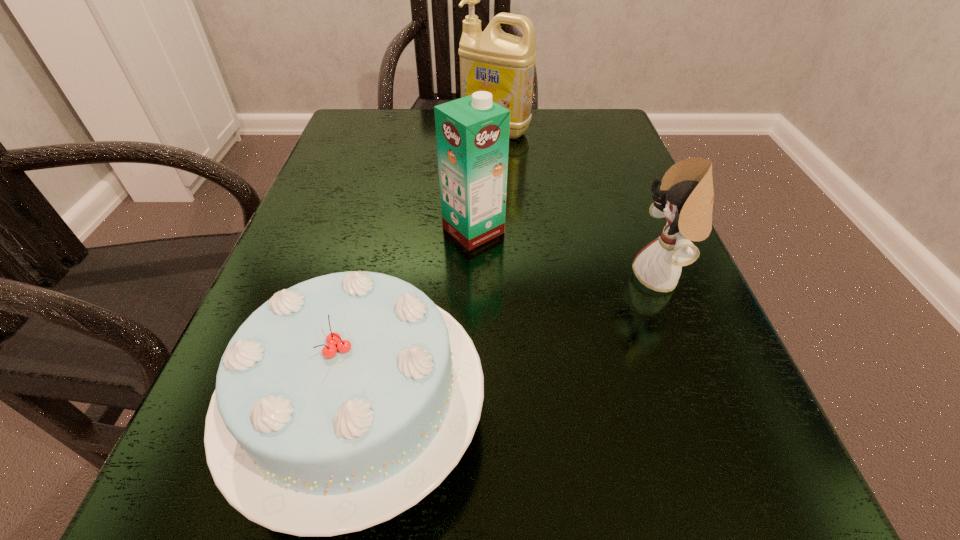
Where is `object that is the third closest to the nearest object`? object that is the third closest to the nearest object is located at coordinates (491, 60).